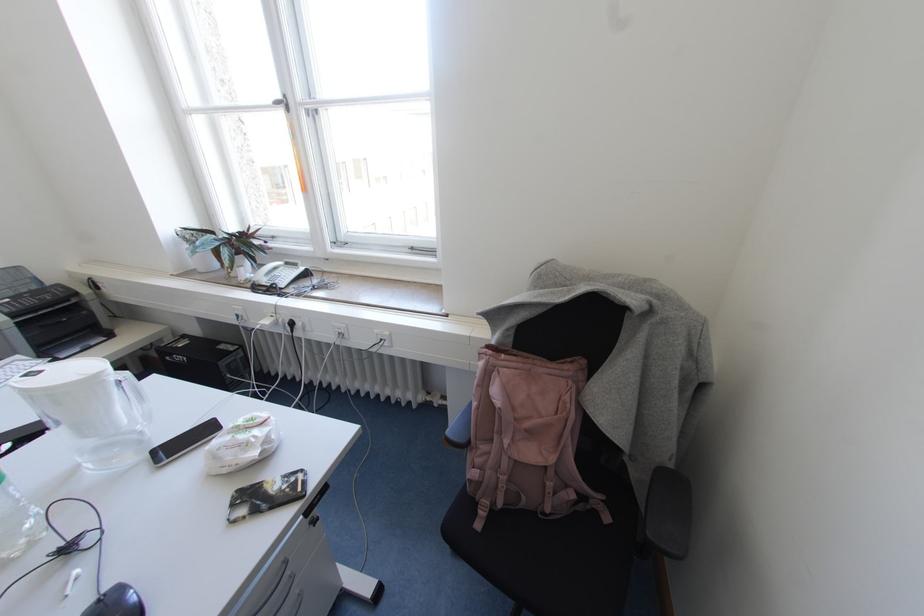
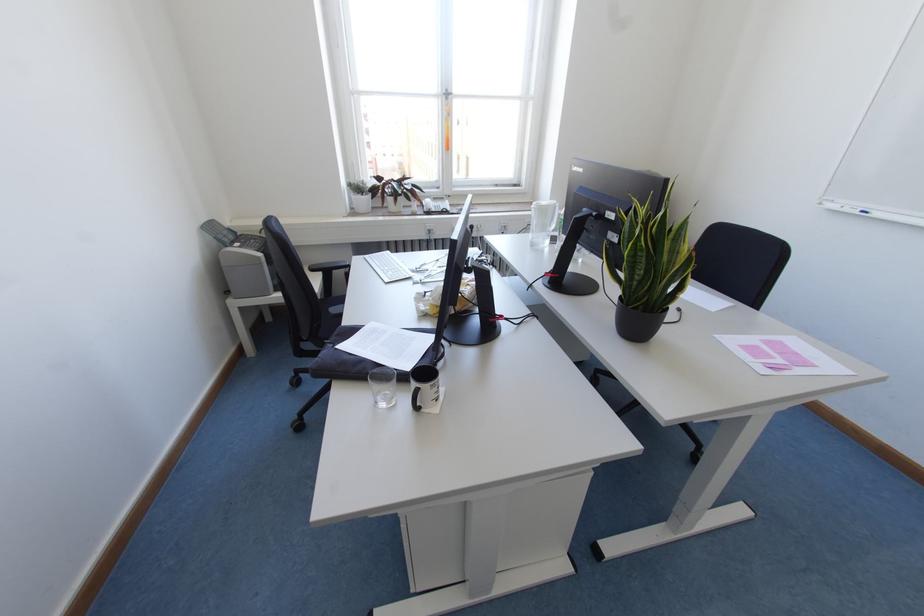
Find the pixel in the second image that matches point 287,108 in the first image.

(446, 98)